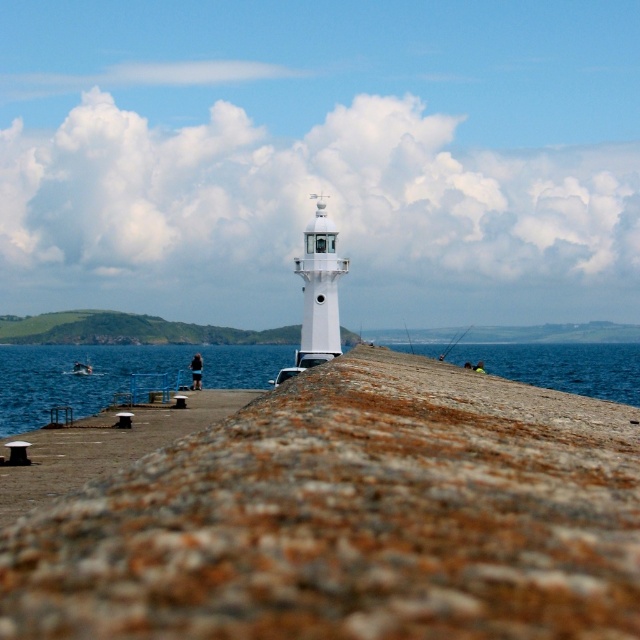
You are a photographer trying to capture the white plastic boat at center in the image. Since the blue water at lower right is larger in the frame, will the boat appear smaller or larger compared to the water?

The blue water at lower right is bigger than the white plastic boat at center, so the boat will appear smaller compared to the water in the photo.

You are a maintenance worker with a 4 feet long ladder. You need to place the ladder between the rusty concrete pier at center and the white lighthouse at the end of the pier. Will the ladder be long enough to bridge the gap between them?

The distance between the rusty concrete pier at center and the white lighthouse at the end of the pier is 4.25 feet. Since the ladder is only 4 feet long, it will not be long enough to bridge the gap between them.